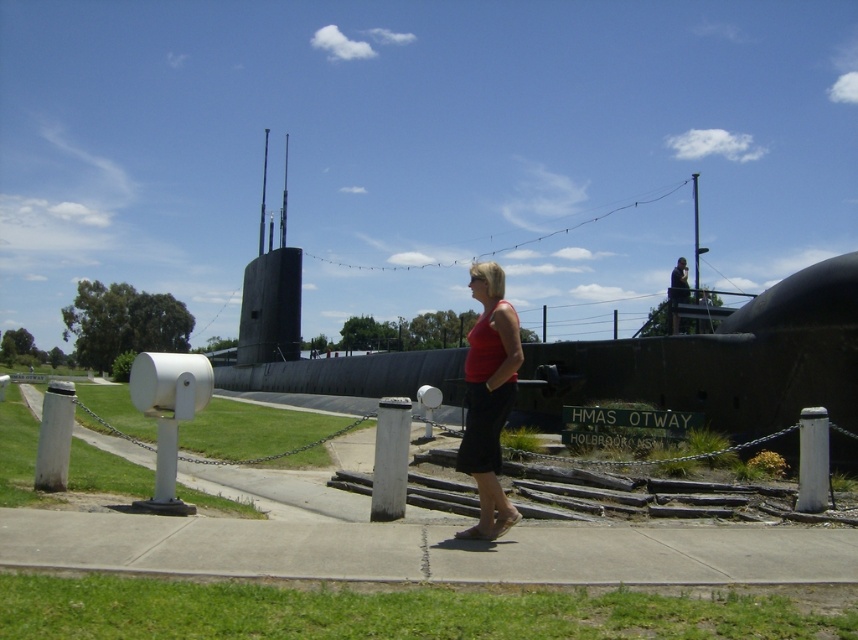
Can you confirm if black matte submarine at center is wider than red matte tank top at center?

Indeed, black matte submarine at center has a greater width compared to red matte tank top at center.

Can you confirm if black matte submarine at center is positioned to the right of red matte tank top at center?

Incorrect, black matte submarine at center is not on the right side of red matte tank top at center.

Does point (730, 317) lie in front of point (494, 467)?

No, (730, 317) is behind (494, 467).

Locate an element on the screen. This screenshot has width=858, height=640. black matte submarine at center is located at coordinates (724, 360).